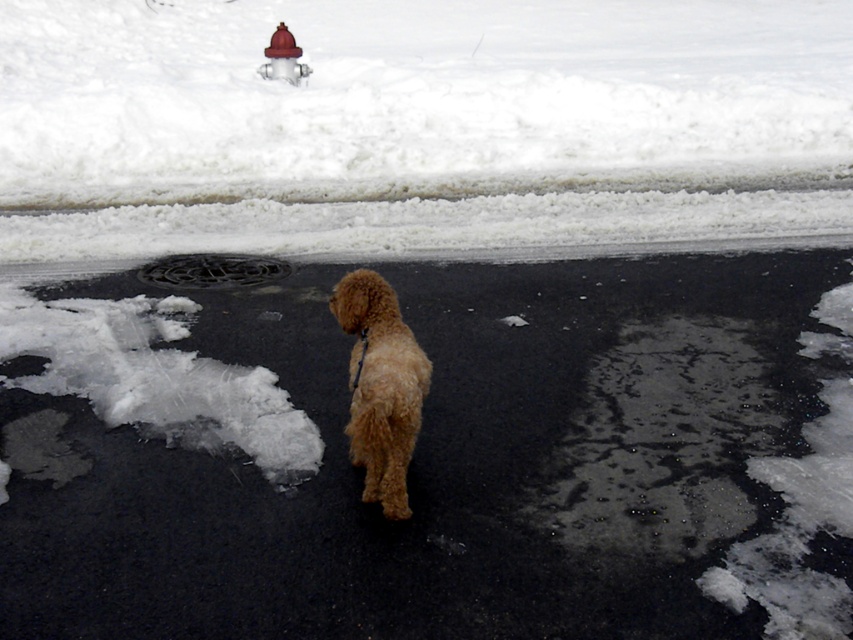
Who is more forward, (456, 467) or (252, 275)?

Point (456, 467)

Can you confirm if brown furry dog at center is positioned below black rubber manhole cover at center?

Yes.

Does point (96, 509) come farther from viewer compared to point (202, 288)?

No, (96, 509) is closer to viewer.

Identify the location of brown furry dog at center. The width and height of the screenshot is (853, 640). coord(434,454).

Between point (154, 268) and point (293, 58), which one is positioned behind?

The point (293, 58) is more distant.

Who is positioned more to the right, black rubber manhole cover at center or brushed metal fire hydrant at upper center?

Positioned to the right is black rubber manhole cover at center.

Is point (221, 253) behind point (291, 40)?

No, (221, 253) is closer to viewer.

Find the location of `black rubber manhole cover at center`. black rubber manhole cover at center is located at coordinates (212, 269).

Between brown furry dog at center and white fluffy snow at upper center, which one appears on the left side from the viewer's perspective?

brown furry dog at center

Can you confirm if brown furry dog at center is positioned below white fluffy snow at upper center?

Yes, brown furry dog at center is below white fluffy snow at upper center.

Measure the distance between brown furry dog at center and camera.

brown furry dog at center is 10.74 feet away from camera.

Where is `brown furry dog at center`? The image size is (853, 640). brown furry dog at center is located at coordinates (434, 454).